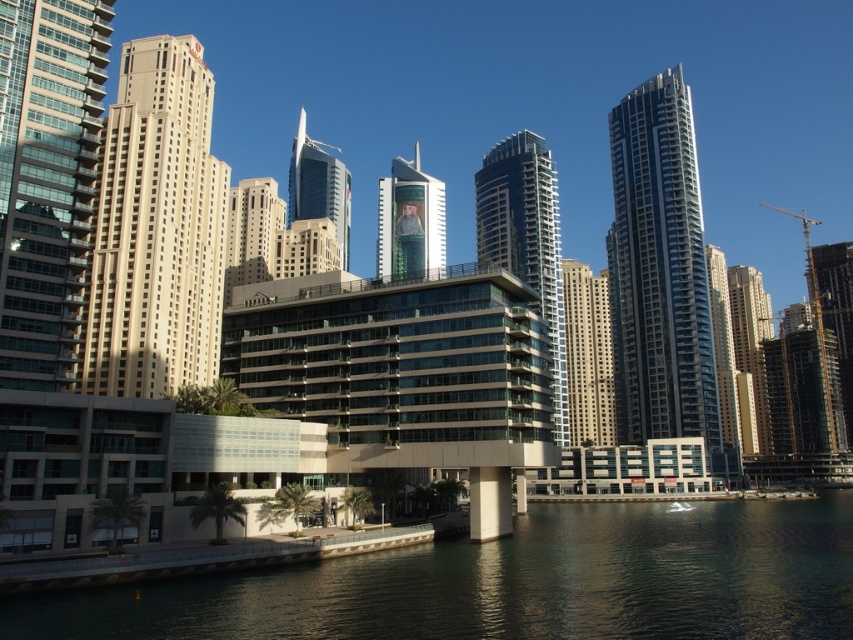
Question: Estimate the real-world distances between objects in this image. Which object is farther from the metallic glass tower at center?

Choices:
 (A) beige concrete building at left
 (B) matte beige building at center
 (C) smooth beige building at right
 (D) glassy blue skyscraper at center

Answer: (C)

Question: Which object appears farthest from the camera in this image?

Choices:
 (A) beige concrete building at left
 (B) metallic glass tower at center
 (C) glassy steel skyscraper at center
 (D) glassy steel skyscraper at center right

Answer: (C)

Question: Which of these objects is positioned closest to the smooth beige building at right?

Choices:
 (A) glassy steel skyscraper at center right
 (B) metallic glass tower at center
 (C) beige concrete building at left

Answer: (A)

Question: Is matte glass building at left below smooth beige building at right?

Choices:
 (A) no
 (B) yes

Answer: (A)

Question: Does greenish reflective water at lower center have a smaller size compared to metallic glass tower at center?

Choices:
 (A) yes
 (B) no

Answer: (A)

Question: Is greenish reflective water at lower center above glassy steel skyscraper at center right?

Choices:
 (A) no
 (B) yes

Answer: (A)